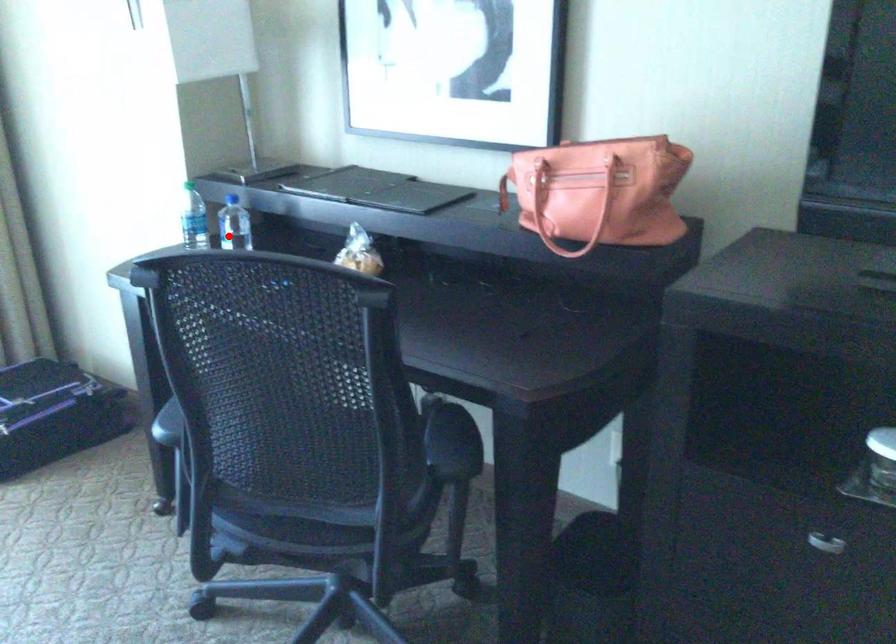
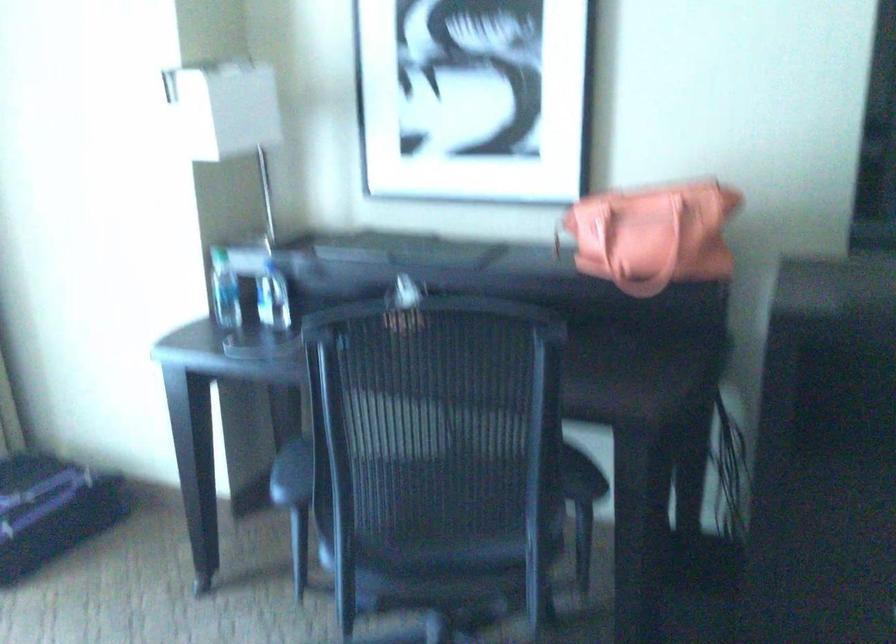
Find the pixel in the second image that matches the highlighted location in the first image.

(271, 299)